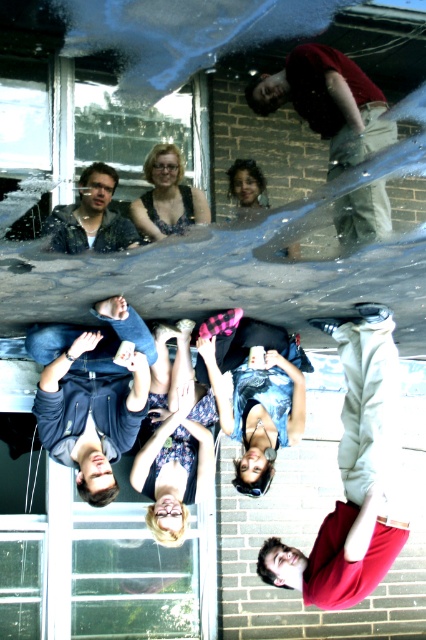
Between light gray hoodie at lower right and denim shorts at center, which one appears on the left side from the viewer's perspective?

denim shorts at center

Can you confirm if light gray hoodie at lower right is positioned to the right of denim shorts at center?

Indeed, light gray hoodie at lower right is positioned on the right side of denim shorts at center.

The width and height of the screenshot is (426, 640). What do you see at coordinates (353, 474) in the screenshot? I see `light gray hoodie at lower right` at bounding box center [353, 474].

You are a GUI agent. You are given a task and a screenshot of the screen. Output one action in this format:
    pyautogui.click(x=<x>, y=<y>)
    Task: Click on the light gray hoodie at lower right
    This screenshot has height=640, width=426.
    Given the screenshot: What is the action you would take?
    pyautogui.click(x=353, y=474)

Is point (348, 196) positioned before point (172, 200)?

Yes, it is.

Between point (363, 188) and point (175, 147), which one is positioned in front?

Point (363, 188) is more forward.

This screenshot has height=640, width=426. Identify the location of red cotton shirt at upper center. (328, 102).

Does floral dress at center have a lesser width compared to smooth skin face at center?

Incorrect, floral dress at center's width is not less than smooth skin face at center's.

Who is higher up, floral dress at center or smooth skin face at center?

smooth skin face at center is higher up.

You are a GUI agent. You are given a task and a screenshot of the screen. Output one action in this format:
    pyautogui.click(x=<x>, y=<y>)
    Task: Click on the floral dress at center
    The height and width of the screenshot is (640, 426).
    Given the screenshot: What is the action you would take?
    pyautogui.click(x=173, y=436)

Identify the location of floral dress at center. Image resolution: width=426 pixels, height=640 pixels. (173, 436).